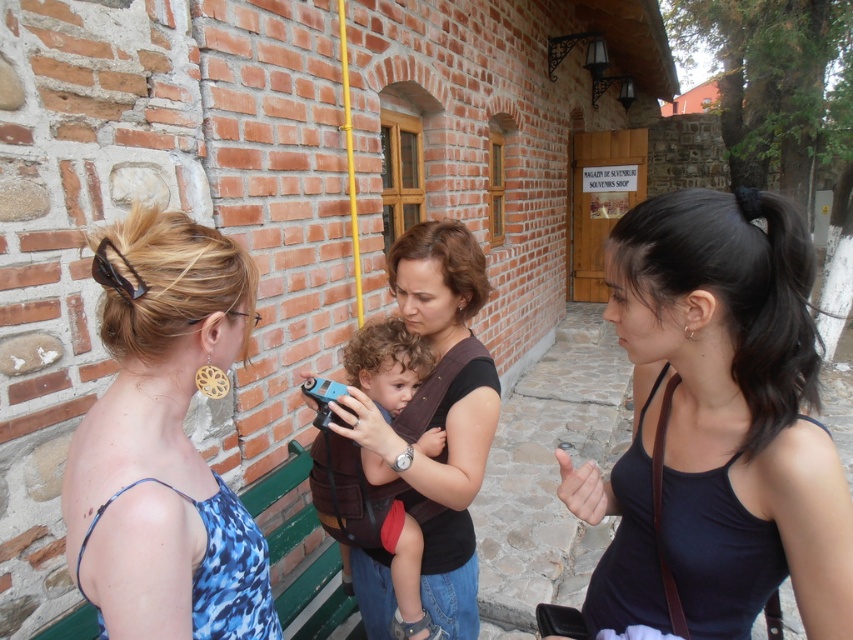
You are a photographer trying to capture a candid shot of the blue printed dress at center and the blue plastic toy car at center. Which object should you focus on first to ensure both are in the frame?

The blue printed dress at center is closer to the viewer than the blue plastic toy car at center, so focus on the blue printed dress at center first to ensure both are in the frame.